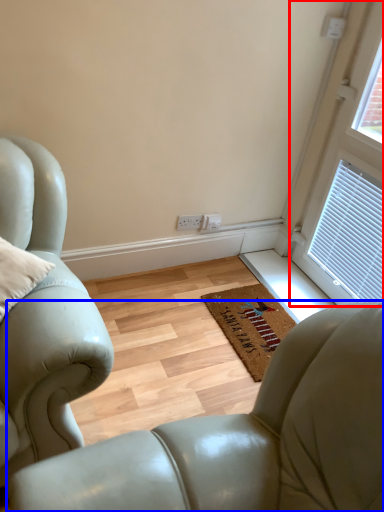
Question: Which of the following is the closest to the observer, window (highlighted by a red box) or chair (highlighted by a blue box)?

Choices:
 (A) window
 (B) chair

Answer: (B)